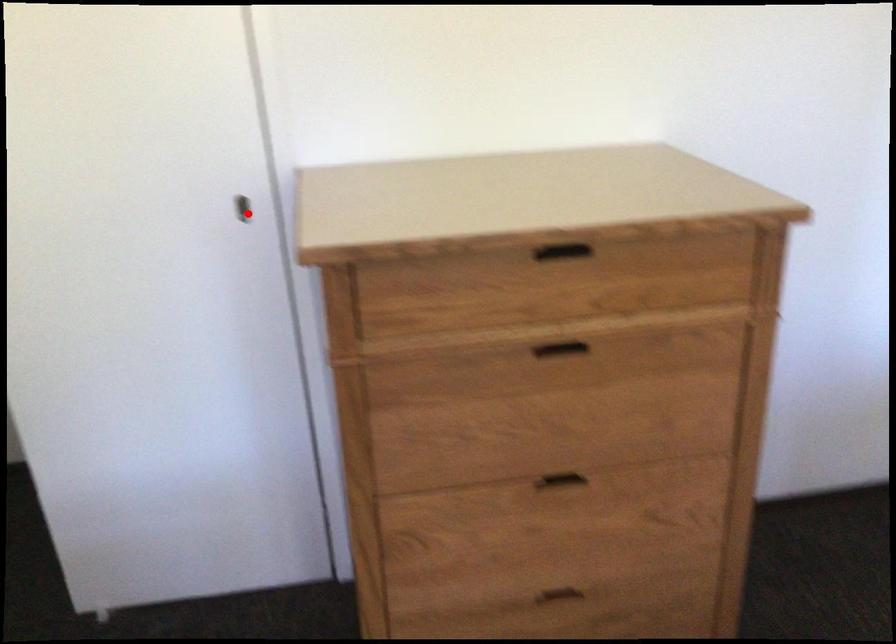
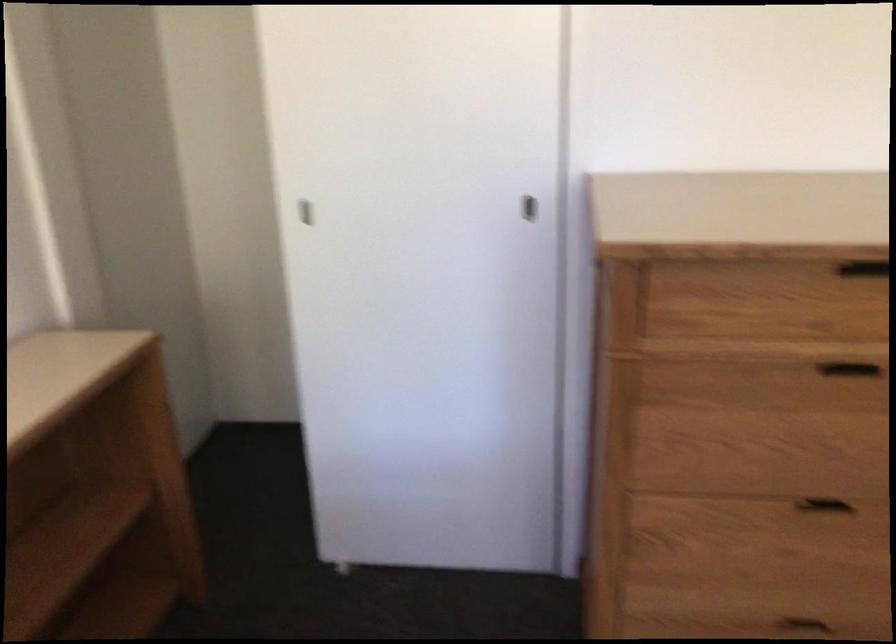
Where in the second image is the point corresponding to the highlighted location from the first image?

(530, 209)